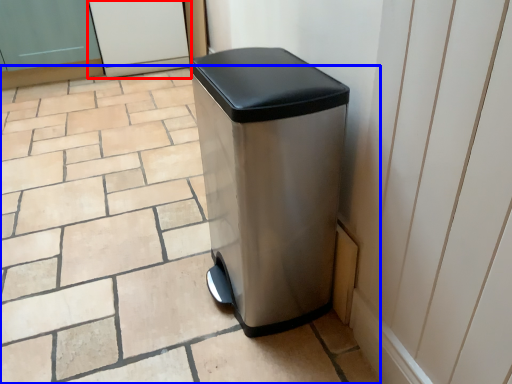
Question: Among these objects, which one is nearest to the camera, screen door (highlighted by a red box) or tile (highlighted by a blue box)?

Choices:
 (A) screen door
 (B) tile

Answer: (B)